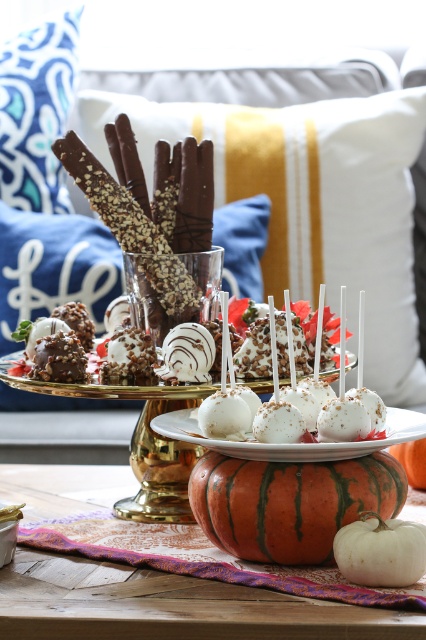
Question: Can you confirm if white matte pumpkin at lower center is positioned to the right of orange matte pumpkin at center?

Choices:
 (A) no
 (B) yes

Answer: (A)

Question: Does white chocolate truffles at center lie behind white chocolate cake pops at center?

Choices:
 (A) no
 (B) yes

Answer: (A)

Question: Which point is closer to the camera taking this photo?

Choices:
 (A) (402, 440)
 (B) (101, 392)
 (C) (368, 564)
 (D) (420, 454)

Answer: (C)

Question: Which object is closer to the camera taking this photo?

Choices:
 (A) orange matte pumpkin at center
 (B) white textured cake pops at center
 (C) white chocolate truffles at center

Answer: (C)

Question: Can you confirm if white textured cake pops at center is thinner than white matte pumpkin at lower center?

Choices:
 (A) no
 (B) yes

Answer: (A)

Question: Which object is farther from the camera taking this photo?

Choices:
 (A) white matte pumpkin at lower center
 (B) white cotton pillow at upper center
 (C) orange pumpkin at center

Answer: (B)